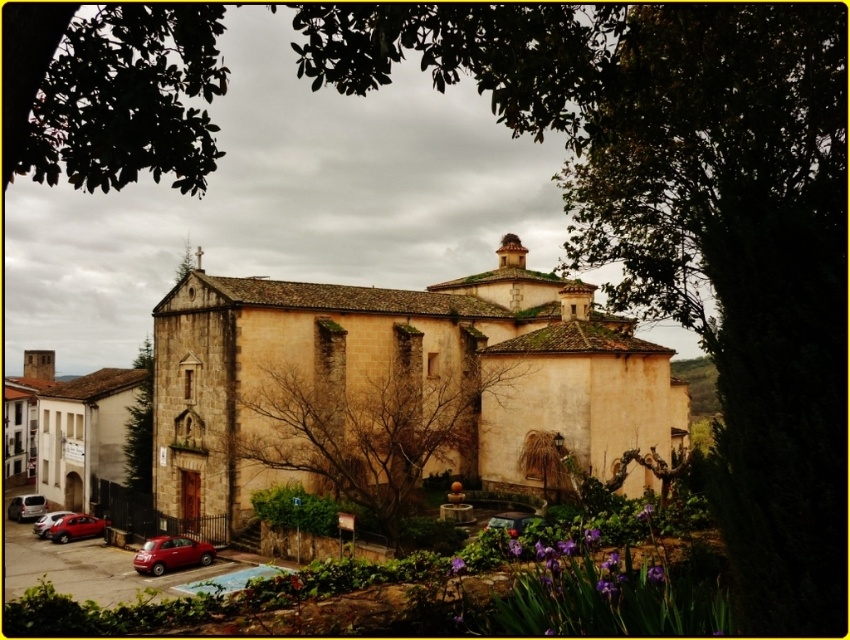
You are a photographer setting up a tripod to capture the historic stone building. You need to position your camera so that both the green textured tree at left and the metallic red car at lower left are visible in the frame. Which object should you place closer to the edge of the frame to ensure both fit without cropping?

Since the green textured tree at left is wider than the metallic red car at lower left, you should position the metallic red car at lower left closer to the edge of the frame to accommodate the tree within the shot.

Looking at this image, you are a delivery driver who needs to park your truck between the metallic silver car at lower left and the matte red car at lower left. However, you notice that there is limited space between them. Can you safely maneuver your truck into this space?

The metallic silver car at lower left is located below the matte red car at lower left, meaning there is no horizontal space between them for the truck to park. Therefore, it is not possible to safely maneuver the truck into this space.